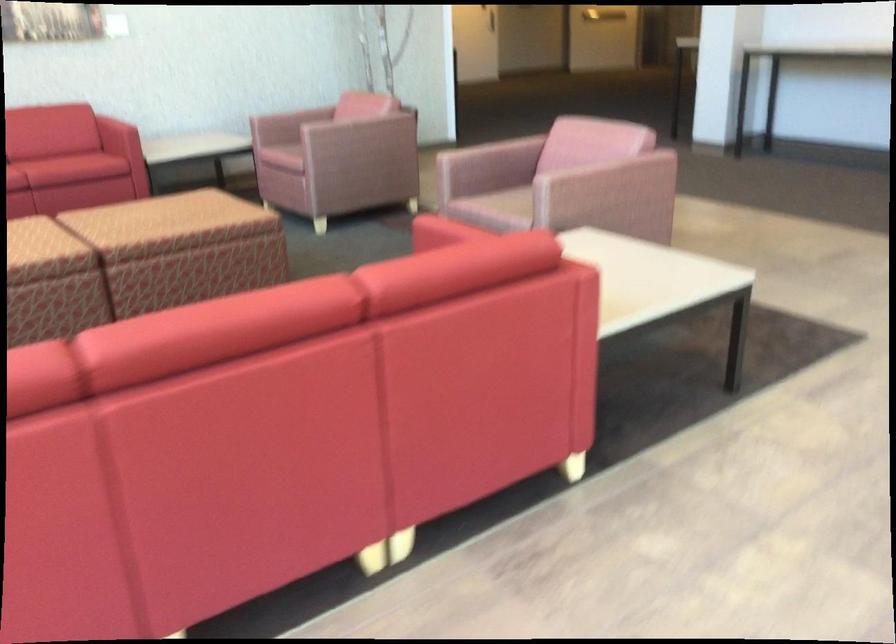
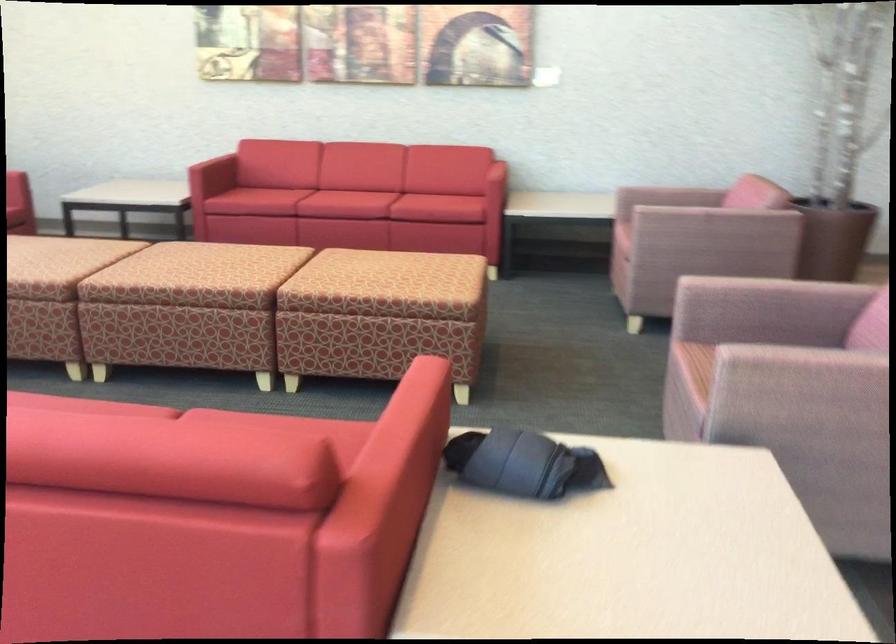
Find the pixel in the second image that matches [528,249] in the first image.

(397, 464)